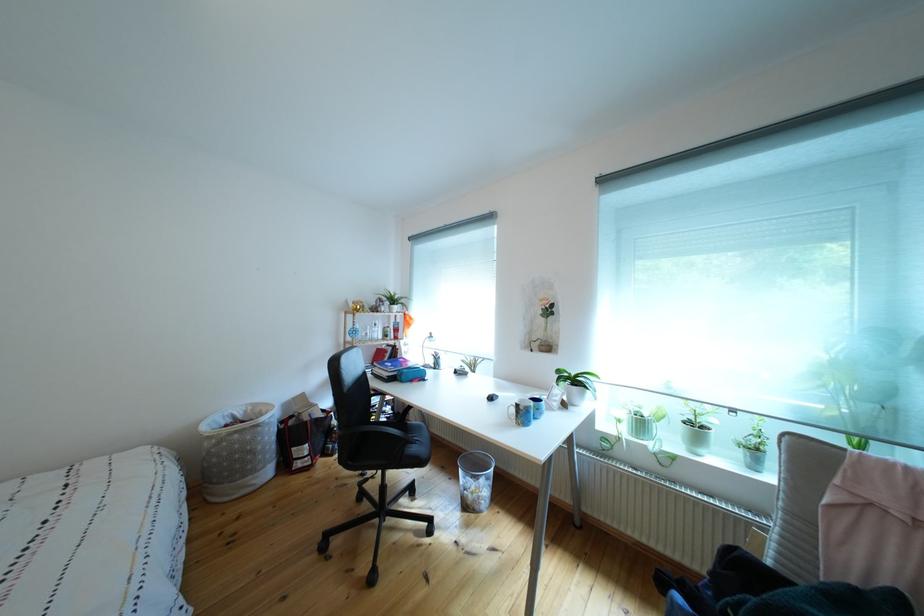
Find the location of a particular element. black chair armrest is located at coordinates (371, 435).